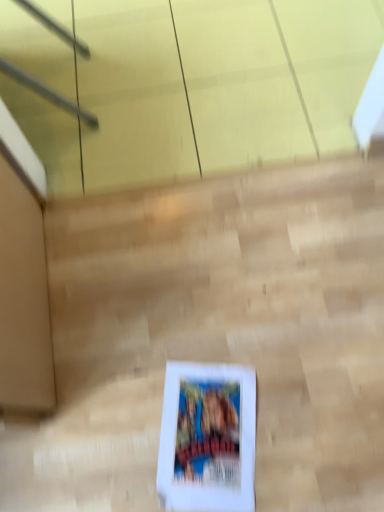
You are a GUI agent. You are given a task and a screenshot of the screen. Output one action in this format:
    pyautogui.click(x=<x>, y=<y>)
    Task: Click on the vacant space behind white paper at center
    
    Given the screenshot: What is the action you would take?
    pyautogui.click(x=199, y=329)